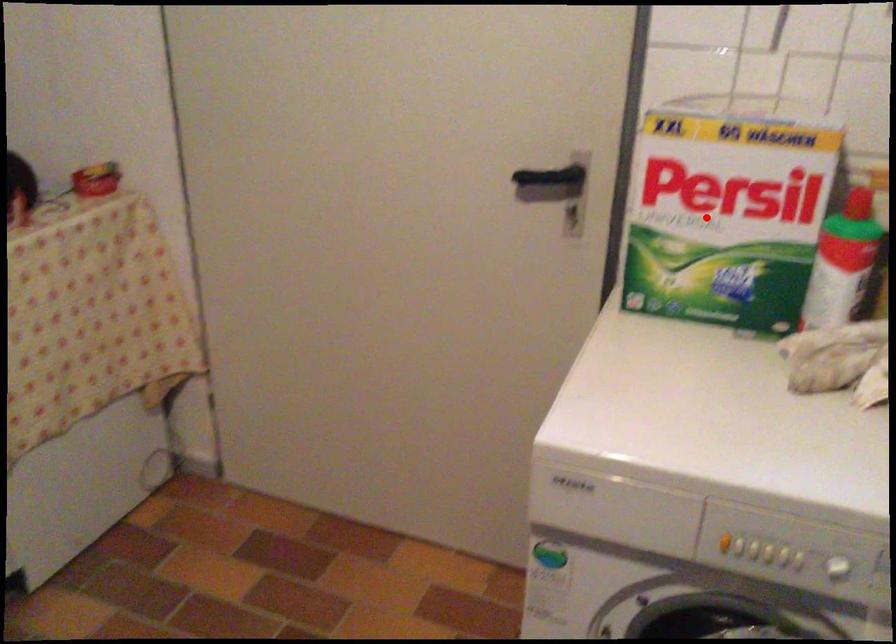
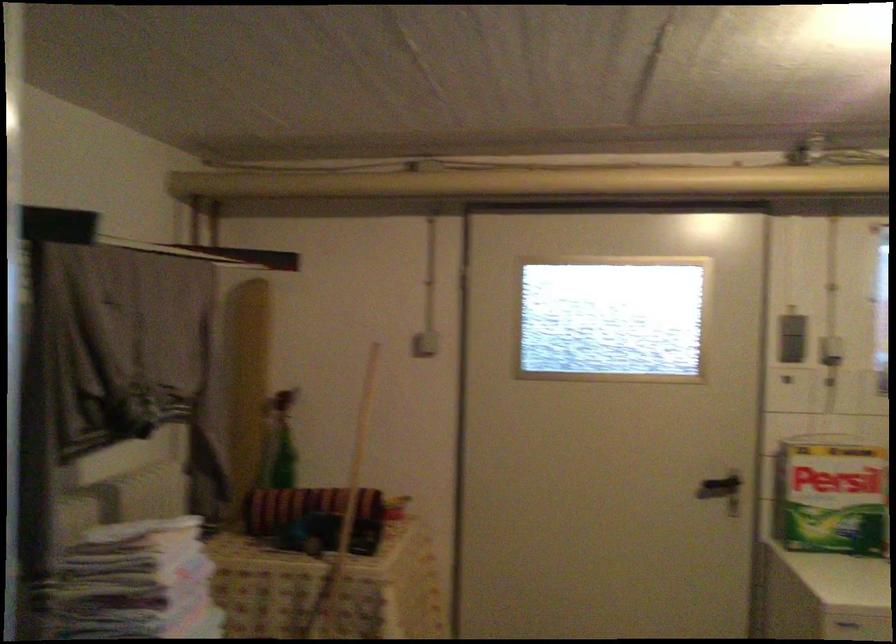
Question: I am providing you with two images of the same scene from different viewpoints. Image1 has a red point marked. In image2, the corresponding 3D location appears at what relative position? Reply with the corresponding letter.

Choices:
 (A) Closer
 (B) Farther

Answer: (B)